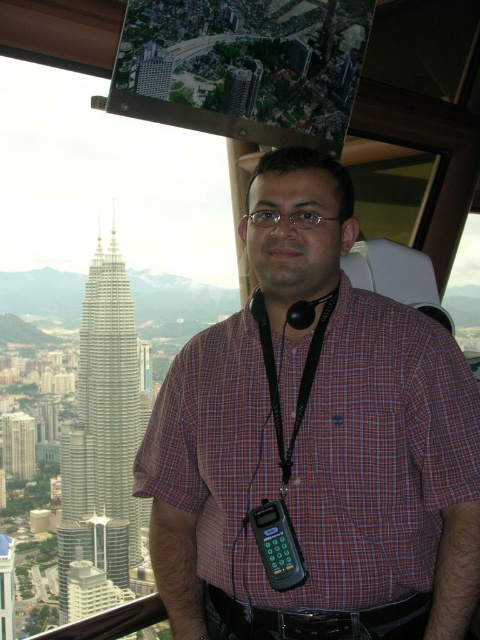
This screenshot has width=480, height=640. I want to click on plaid shirt at center, so click(314, 442).

Is point (241, 556) positioned behind point (15, 470)?

No, it is not.

I want to click on plaid shirt at center, so click(x=314, y=442).

Consider the image. Is black fabric lanyard at center above green glass building at left?

Indeed, black fabric lanyard at center is positioned over green glass building at left.

Is black fabric lanyard at center below green glass building at left?

No.

Which is behind, point (312, 310) or point (3, 435)?

Point (3, 435)

Identify the location of black fabric lanyard at center. (305, 362).

Is plaid shirt at center smaller than black fabric lanyard at center?

Incorrect, plaid shirt at center is not smaller in size than black fabric lanyard at center.

What do you see at coordinates (314, 442) in the screenshot? This screenshot has height=640, width=480. I see `plaid shirt at center` at bounding box center [314, 442].

At what (x,y) coordinates should I click in order to perform the action: click on plaid shirt at center. Please return your answer as a coordinate pair (x, y). The height and width of the screenshot is (640, 480). Looking at the image, I should click on (314, 442).